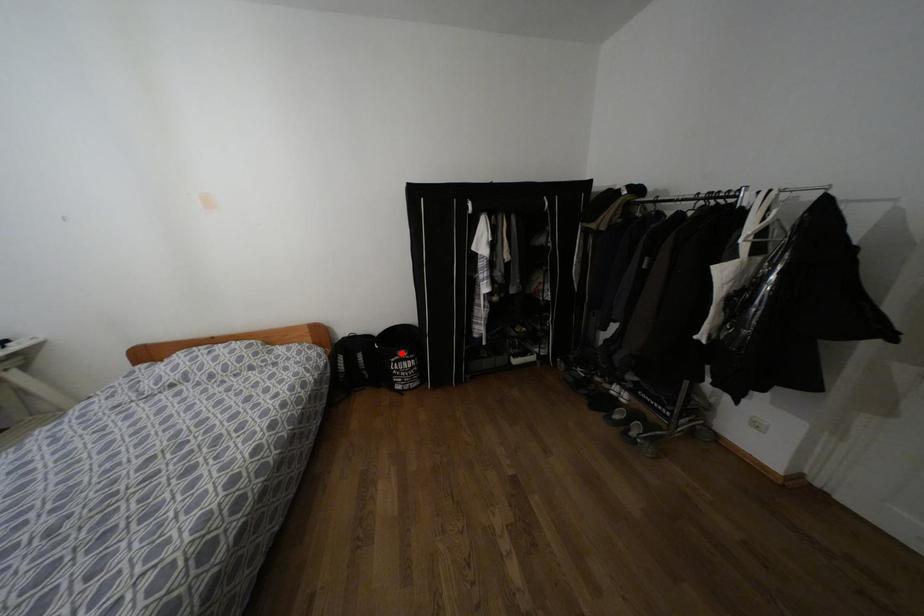
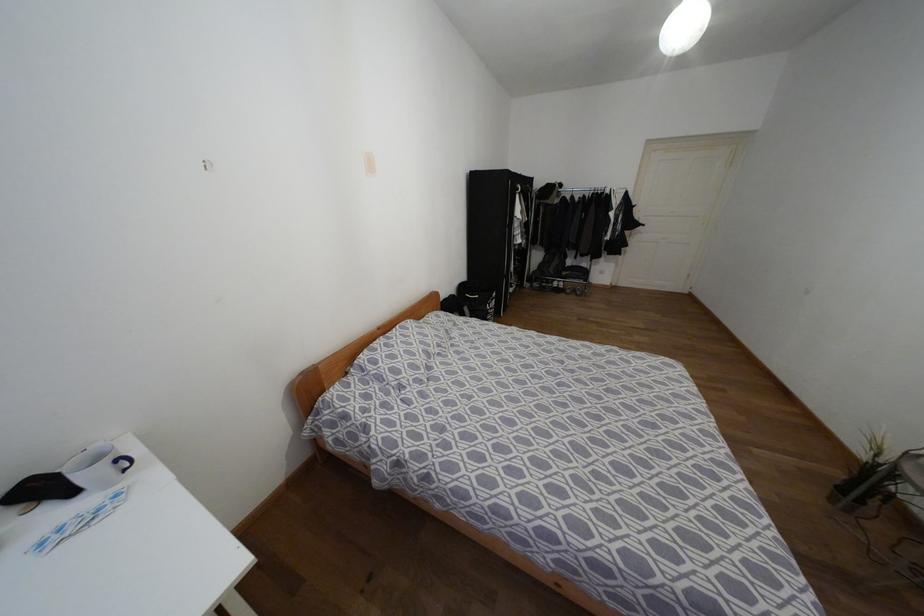
Find the pixel in the second image that matches the highlighted location in the first image.

(493, 294)